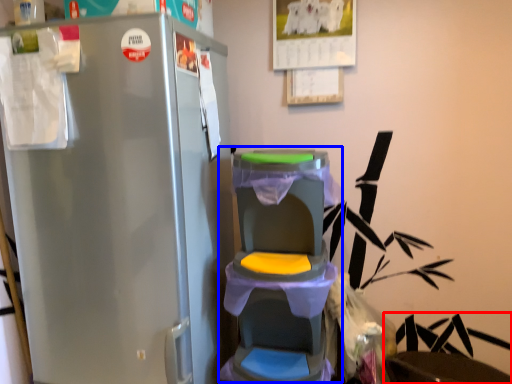
Question: Which of the following is the closest to the observer, swivel chair (highlighted by a red box) or baby carriage (highlighted by a blue box)?

Choices:
 (A) swivel chair
 (B) baby carriage

Answer: (B)